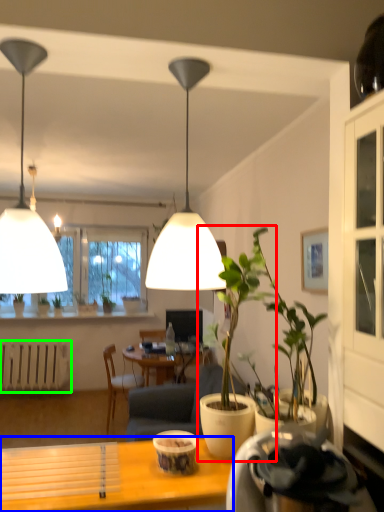
Question: Considering the real-world distances, which object is farthest from houseplant (highlighted by a red box)? desk (highlighted by a blue box) or radiator (highlighted by a green box)?

Choices:
 (A) desk
 (B) radiator

Answer: (B)